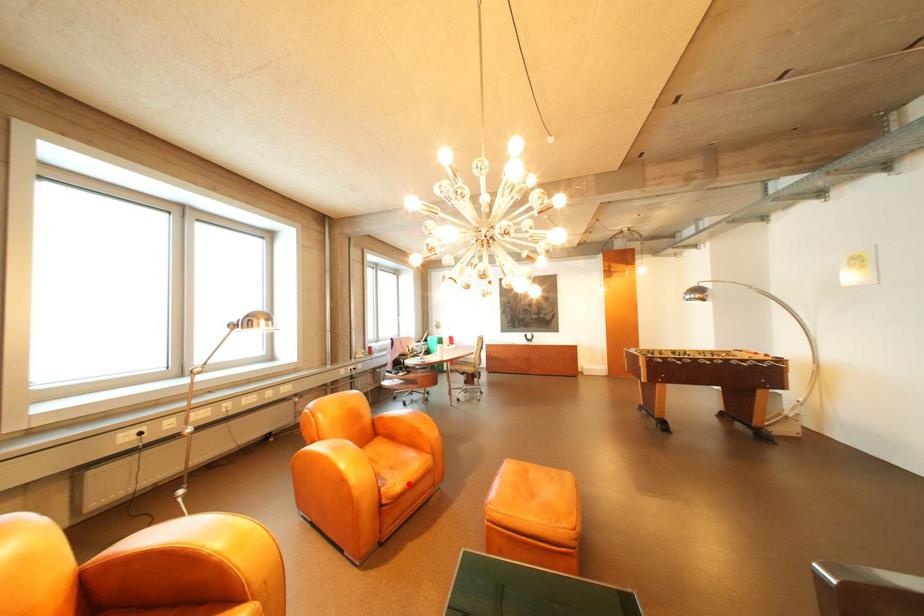
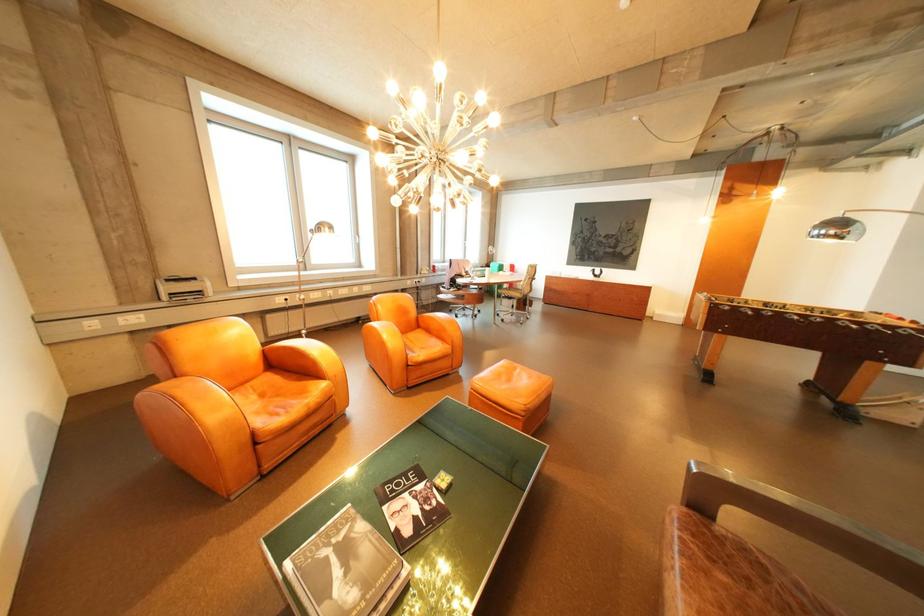
The point at the highlighted location is marked in the first image. Where is the corresponding point in the second image?

(432, 355)